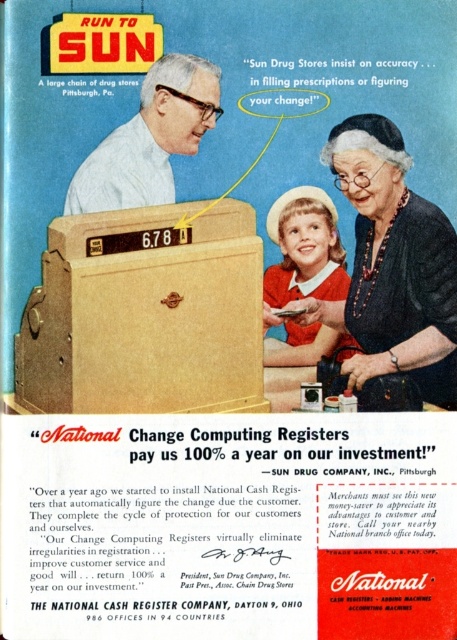
In the vintage Sun Drug Stores advertisement, there is a wooden box at center and a matte black dress at center. Which object is positioned to the left when viewed from the front?

The wooden box at center is to the left of the matte black dress at center.

You are a customer standing in front of the Sun Drug Stores advertisement. You notice the wooden box at center and the matte white shirt at center. Which object is positioned lower in the image?

The wooden box at center is located below the matte white shirt at center, so it is positioned lower in the image.

You are designing a layout for a new advertisement and need to place a smaller decorative item next to the wooden box at center and the matte white shirt at center. Given their sizes, which object should the decorative item be placed next to to ensure it doesn not overwhelm the smaller one?

The wooden box at center has a larger width than the matte white shirt at center. Therefore, the decorative item should be placed next to the matte white shirt at center to avoid overwhelming it.